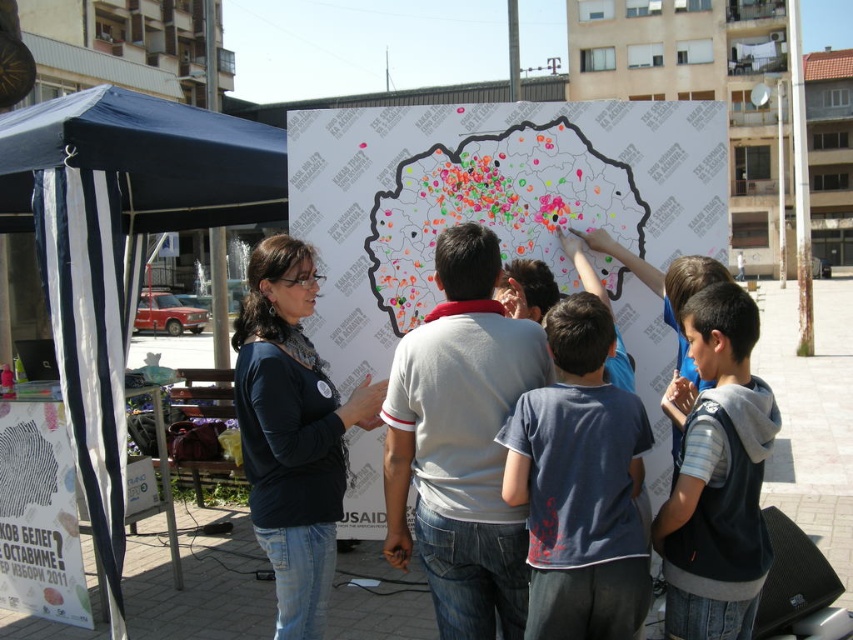
You are a photographer standing in the plaza and want to take a photo of the white paper map at center and the black matte shirt at center. Which object should you focus on first if you want to ensure both are in focus without adjusting the camera settings?

The white paper map at center has a greater height compared to the black matte shirt at center, so focusing on the taller object first would help ensure both are in focus.

You are standing at the point labeled point (610, 472). The facilitator is standing at the other point. Can you walk directly to the facilitator without moving past the large white board?

The points are 7.59 feet apart. Since the large white board is between them, you would need to move around it, so you cannot walk directly to the facilitator without moving past the large white board.